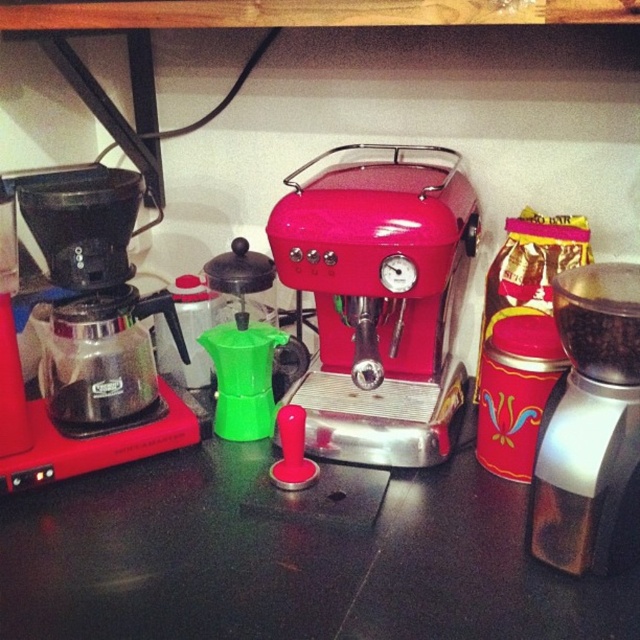
Question: Which object appears closest to the camera in this image?

Choices:
 (A) black matte counter top at center
 (B) glossy metallic espresso machine at center

Answer: (A)

Question: Can you confirm if glossy metallic espresso machine at center is wider than metallic silver grinder at center?

Choices:
 (A) no
 (B) yes

Answer: (B)

Question: From the image, what is the correct spatial relationship of glossy metallic espresso machine at center in relation to metallic silver grinder at center?

Choices:
 (A) below
 (B) above

Answer: (B)

Question: Which point appears farthest from the camera in this image?

Choices:
 (A) (464, 284)
 (B) (611, 620)
 (C) (612, 376)

Answer: (A)

Question: From the image, what is the correct spatial relationship of glossy metallic espresso machine at center in relation to metallic silver grinder at center?

Choices:
 (A) above
 (B) below

Answer: (A)

Question: Considering the real-world distances, which object is farthest from the black matte counter top at center?

Choices:
 (A) glossy metallic espresso machine at center
 (B) metallic silver grinder at center

Answer: (B)